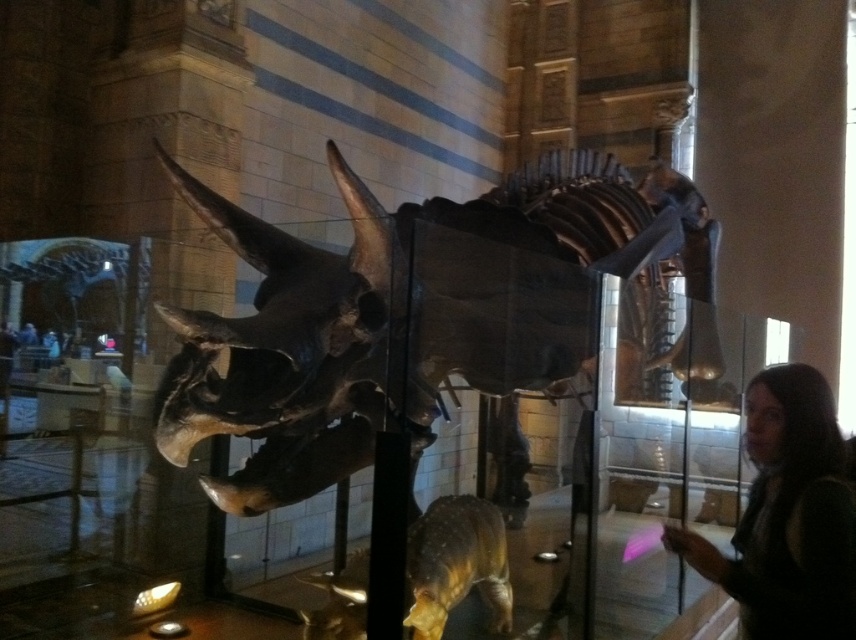
You are a visitor at the museum holding a 1.5 meter long measuring tape. You want to measure the distance between the shiny metallic dinosaur skeleton at center and the dark brown hair at lower right. Can you reach both ends of the measuring tape to the objects simultaneously?

The distance between the shiny metallic dinosaur skeleton at center and the dark brown hair at lower right is 1.45 meters. Since the measuring tape is 1.5 meters long, you can extend it fully and reach both objects simultaneously as the distance is slightly shorter than the tape.

You are standing in the museum and want to take a photo of the shiny metallic dinosaur skeleton at center. The museum requires visitors to stay at least 1 meter away from the display. Given that the point representing the skeleton is at coordinates point (419, 317), can you determine if you are within the required distance?

The shiny metallic dinosaur skeleton at center is represented by point (419, 317). Since the museum requires visitors to stay at least 1 meter away from the display, you need to ensure your position is at least 1 meter away from this point. Without knowing your exact location, it is impossible to determine if you are within the required distance.